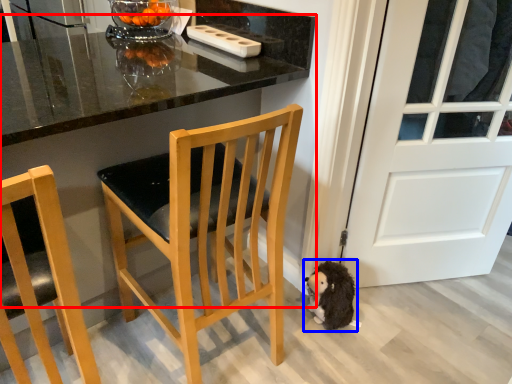
Question: Which object appears closest to the camera in this image, table (highlighted by a red box) or animal (highlighted by a blue box)?

Choices:
 (A) table
 (B) animal

Answer: (A)